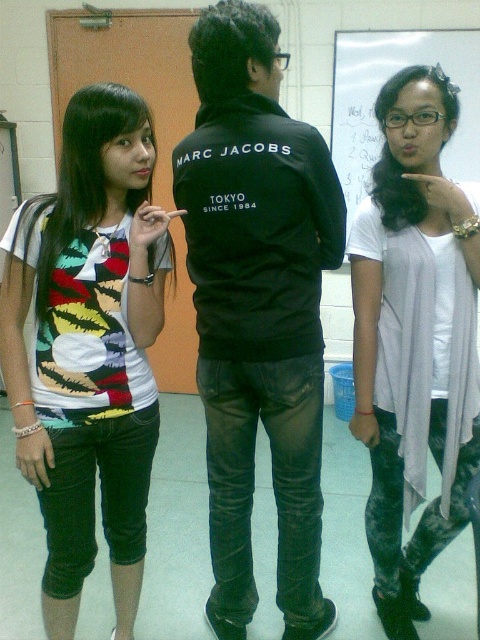
The height and width of the screenshot is (640, 480). Describe the element at coordinates (257, 308) in the screenshot. I see `black matte jacket at center` at that location.

Between black matte jacket at center and light gray sheer cardigan at center, which one has less height?

light gray sheer cardigan at center

This screenshot has width=480, height=640. Identify the location of black matte jacket at center. (257, 308).

Is multicolored printed t-shirt at left below light gray sheer cardigan at center?

Correct, multicolored printed t-shirt at left is located below light gray sheer cardigan at center.

Is multicolored printed t-shirt at left positioned behind light gray sheer cardigan at center?

No, multicolored printed t-shirt at left is in front of light gray sheer cardigan at center.

Between point (7, 372) and point (376, 582), which one is positioned in front?

Point (7, 372)

This screenshot has height=640, width=480. I want to click on multicolored printed t-shirt at left, so click(x=88, y=348).

Looking at this image, can you confirm if black matte jacket at center is positioned below white paper at upper center?

Correct, black matte jacket at center is located below white paper at upper center.

Does black matte jacket at center appear over white paper at upper center?

Actually, black matte jacket at center is below white paper at upper center.

This screenshot has width=480, height=640. Describe the element at coordinates (257, 308) in the screenshot. I see `black matte jacket at center` at that location.

At what (x,y) coordinates should I click in order to perform the action: click on black matte jacket at center. Please return your answer as a coordinate pair (x, y). This screenshot has height=640, width=480. Looking at the image, I should click on (257, 308).